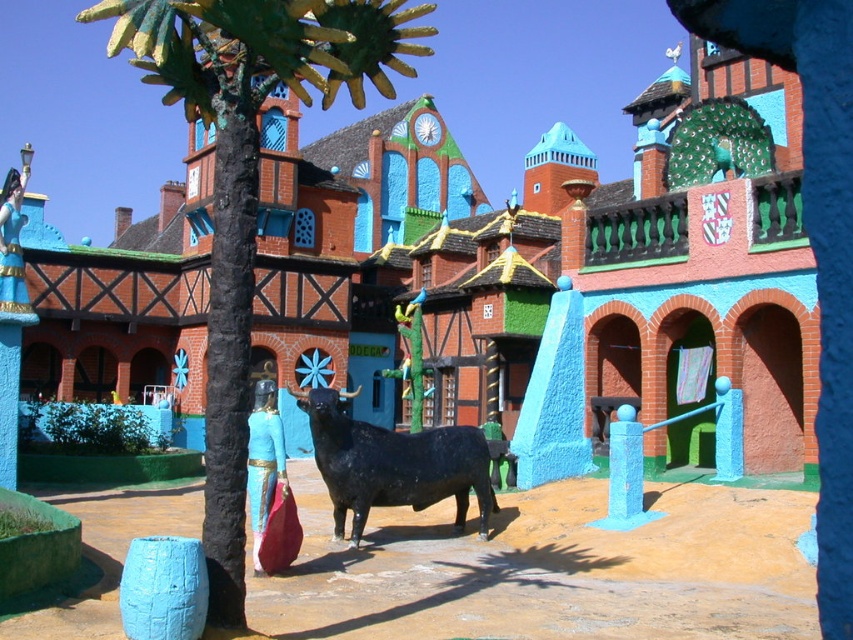
Can you confirm if green painted wood palm tree at center is positioned above black matte bull at center?

Yes.

Can you confirm if green painted wood palm tree at center is positioned below black matte bull at center?

Incorrect, green painted wood palm tree at center is not positioned below black matte bull at center.

Who is more forward, (161, 83) or (492, 490)?

Point (161, 83)

Locate an element on the screen. Image resolution: width=853 pixels, height=640 pixels. green painted wood palm tree at center is located at coordinates (248, 179).